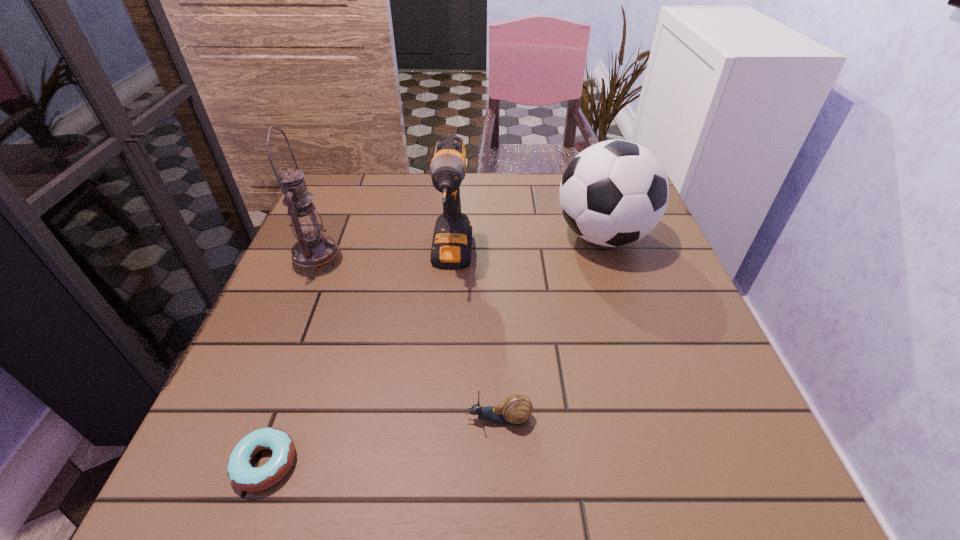
You are a GUI agent. You are given a task and a screenshot of the screen. Output one action in this format:
    pyautogui.click(x=<x>, y=<y>)
    Task: Click on the free space between the drill and the oil lamp
    
    Given the screenshot: What is the action you would take?
    pyautogui.click(x=385, y=260)

Where is `free space between the oil lamp and the drill`? free space between the oil lamp and the drill is located at coordinates (385, 260).

You are a GUI agent. You are given a task and a screenshot of the screen. Output one action in this format:
    pyautogui.click(x=<x>, y=<y>)
    Task: Click on the vacant space that is in between the oil lamp and the drill
    The image size is (960, 540).
    Given the screenshot: What is the action you would take?
    pyautogui.click(x=385, y=260)

You are a GUI agent. You are given a task and a screenshot of the screen. Output one action in this format:
    pyautogui.click(x=<x>, y=<y>)
    Task: Click on the vacant region between the drill and the escargot
    This screenshot has width=960, height=540.
    Given the screenshot: What is the action you would take?
    pyautogui.click(x=475, y=339)

Locate an element on the screen. empty space that is in between the tallest object and the drill is located at coordinates (385, 260).

Identify the location of unoccupied area between the rightmost object and the drill. The image size is (960, 540). (527, 247).

At what (x,y) coordinates should I click in order to perform the action: click on free area in between the soccer ball and the doughnut. Please return your answer as a coordinate pair (x, y). The image size is (960, 540). Looking at the image, I should click on (434, 349).

Locate an element on the screen. object that is the second closest one to the second shortest object is located at coordinates (451, 247).

Identify the location of the third closest object to the shortest object. The width and height of the screenshot is (960, 540). (314, 254).

This screenshot has width=960, height=540. In order to click on free spot that satisfies the following two spatial constraints: 1. on the front side of the soccer ball; 2. on the front-facing side of the escargot in this screenshot , I will do `click(663, 418)`.